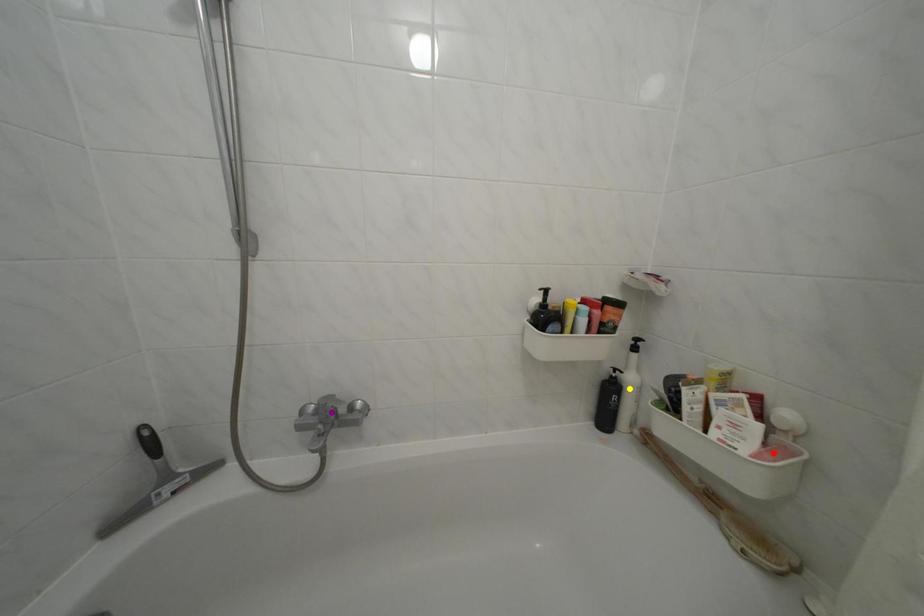
Based on the photo, order these from farthest to nearest:
red point, purple point, yellow point

1. yellow point
2. purple point
3. red point